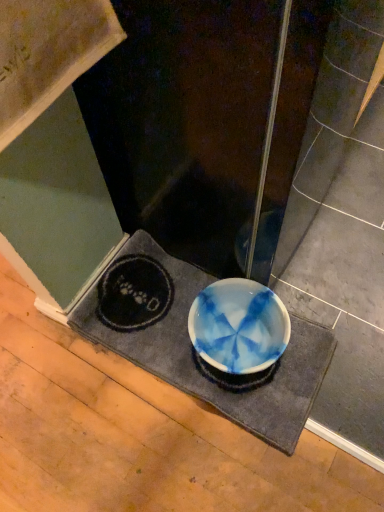
Find the location of `free point in front of blue tie-dye fabric bath mat at center`. free point in front of blue tie-dye fabric bath mat at center is located at coordinates (205, 460).